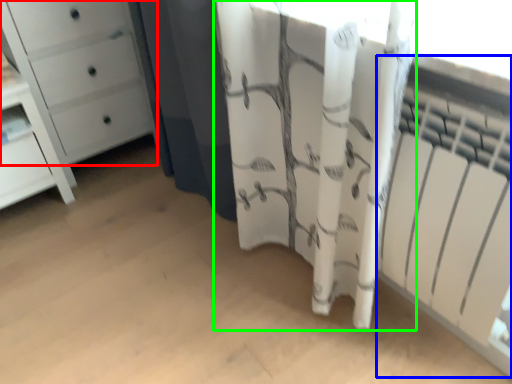
Question: Which object is the closest to the chest of drawers (highlighted by a red box)? Choose among these: radiator (highlighted by a blue box) or curtain (highlighted by a green box).

Choices:
 (A) radiator
 (B) curtain

Answer: (B)